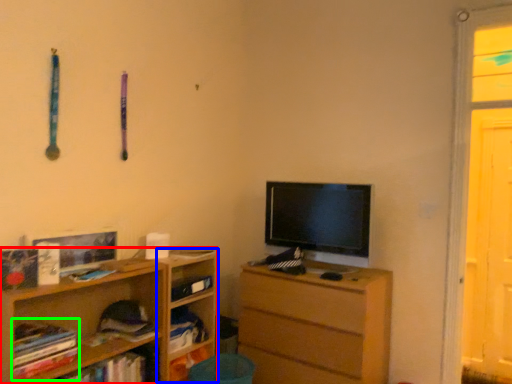
Question: Estimate the real-world distances between objects in this image. Which object is farther from shelf (highlighted by a red box), shelf (highlighted by a blue box) or book (highlighted by a green box)?

Choices:
 (A) shelf
 (B) book

Answer: (B)